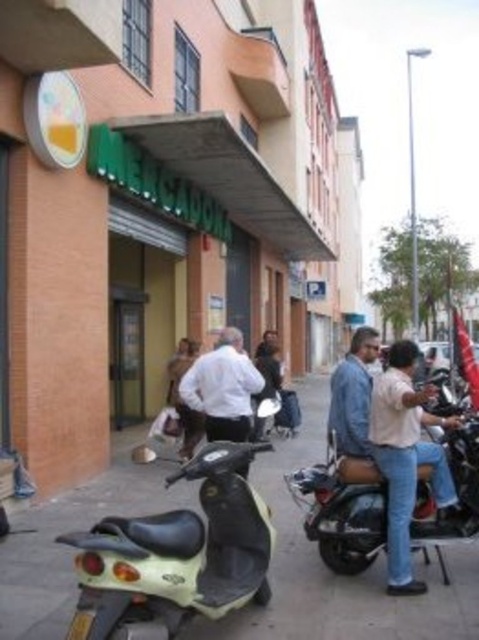
Question: Is smooth concrete pavement at center to the left of denim jeans at lower right from the viewer's perspective?

Choices:
 (A) yes
 (B) no

Answer: (A)

Question: Is metallic silver scooter at lower right bigger than white matte shirt at center?

Choices:
 (A) yes
 (B) no

Answer: (B)

Question: Which point appears closest to the camera in this image?

Choices:
 (A) (260, 387)
 (B) (467, 474)
 (C) (415, 428)
 (D) (462, 554)

Answer: (B)

Question: Which point is closer to the camera?

Choices:
 (A) metallic silver scooter at lower right
 (B) white matte shirt at center

Answer: (A)

Question: Which point is closer to the camera taking this photo?

Choices:
 (A) (376, 490)
 (B) (195, 378)

Answer: (A)

Question: Is metallic silver scooter at lower right in front of denim jeans at lower right?

Choices:
 (A) no
 (B) yes

Answer: (A)